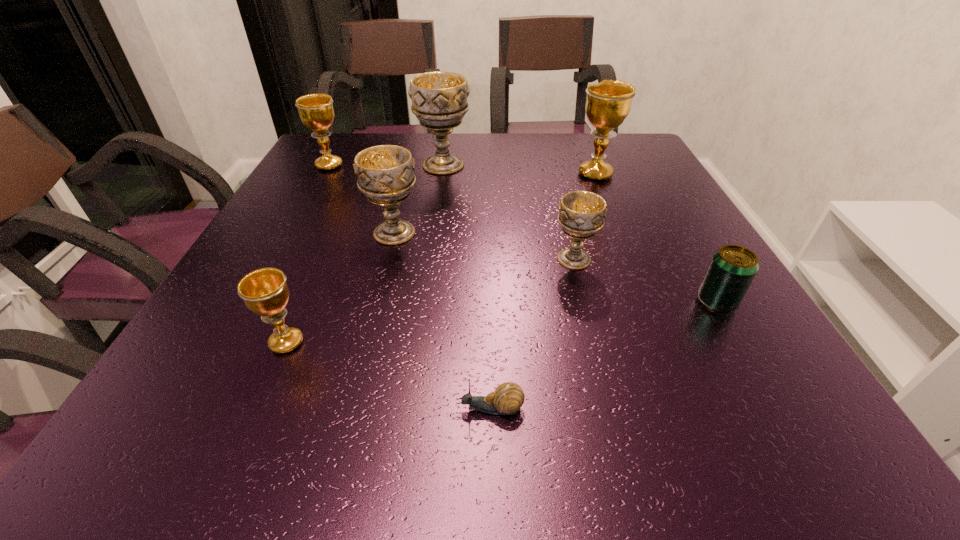
Identify the location of white chalice that is the closest to the biggest white chalice. Image resolution: width=960 pixels, height=540 pixels. [385, 174].

Identify the location of gold chalice that is the second nearest to the fifth chalice from right to left. (608, 103).

Identify which gold chalice is the second nearest to the shortest object. Please provide its 2D coordinates. Your answer should be formatted as a tuple, i.e. [(x, y)], where the tuple contains the x and y coordinates of a point satisfying the conditions above.

[(608, 103)]